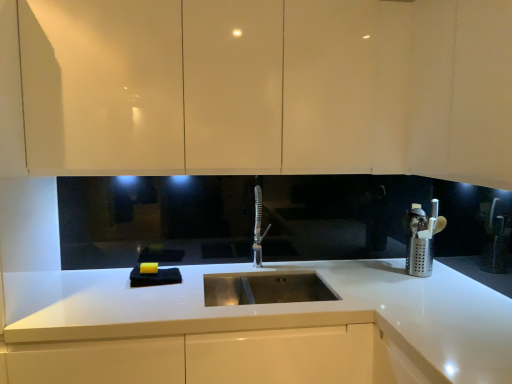
Question: Is satin nickel faucet at center at the back of silver perforated utensil holder at right?

Choices:
 (A) no
 (B) yes

Answer: (A)

Question: From a real-world perspective, is silver perforated utensil holder at right on satin nickel faucet at center?

Choices:
 (A) yes
 (B) no

Answer: (B)

Question: Is silver perforated utensil holder at right outside satin nickel faucet at center?

Choices:
 (A) no
 (B) yes

Answer: (B)

Question: Is the position of silver perforated utensil holder at right less distant than that of satin nickel faucet at center?

Choices:
 (A) yes
 (B) no

Answer: (B)

Question: From the image's perspective, is silver perforated utensil holder at right over satin nickel faucet at center?

Choices:
 (A) no
 (B) yes

Answer: (A)

Question: Considering the positions of silver perforated utensil holder at right and satin nickel faucet at center in the image, is silver perforated utensil holder at right bigger or smaller than satin nickel faucet at center?

Choices:
 (A) big
 (B) small

Answer: (A)

Question: In the image, is silver perforated utensil holder at right positioned in front of or behind satin nickel faucet at center?

Choices:
 (A) behind
 (B) front

Answer: (A)

Question: In the image, is silver perforated utensil holder at right on the left side or the right side of satin nickel faucet at center?

Choices:
 (A) left
 (B) right

Answer: (B)

Question: From the image's perspective, is silver perforated utensil holder at right above or below satin nickel faucet at center?

Choices:
 (A) below
 (B) above

Answer: (A)

Question: Is white glossy countertop at center bigger or smaller than matte white cabinets at upper center?

Choices:
 (A) big
 (B) small

Answer: (A)

Question: From a real-world perspective, is white glossy countertop at center positioned above or below matte white cabinets at upper center?

Choices:
 (A) below
 (B) above

Answer: (A)

Question: Is point (450, 309) closer or farther from the camera than point (48, 110)?

Choices:
 (A) farther
 (B) closer

Answer: (B)

Question: From the image's perspective, is white glossy countertop at center above or below matte white cabinets at upper center?

Choices:
 (A) above
 (B) below

Answer: (B)

Question: Does point (332, 344) appear closer or farther from the camera than point (258, 187)?

Choices:
 (A) farther
 (B) closer

Answer: (B)

Question: Is white glossy countertop at center spatially inside satin nickel faucet at center, or outside of it?

Choices:
 (A) inside
 (B) outside

Answer: (B)